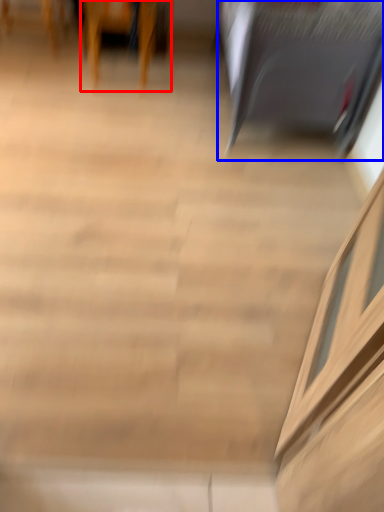
Question: Which object is further to the camera taking this photo, furniture (highlighted by a red box) or furniture (highlighted by a blue box)?

Choices:
 (A) furniture
 (B) furniture

Answer: (A)